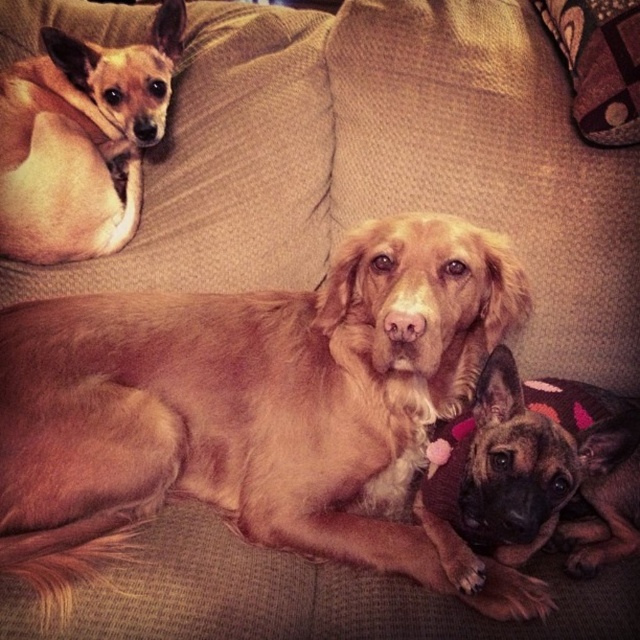
Between point (16, 116) and point (488, 388), which one is positioned in front?

Point (488, 388)

Which of these two, light brown fur at upper left or brown furry dog at lower right, stands taller?

light brown fur at upper left is taller.

Who is more forward, (x=68, y=113) or (x=483, y=387)?

Positioned in front is point (x=483, y=387).

Identify the location of light brown fur at upper left. Image resolution: width=640 pixels, height=640 pixels. (81, 140).